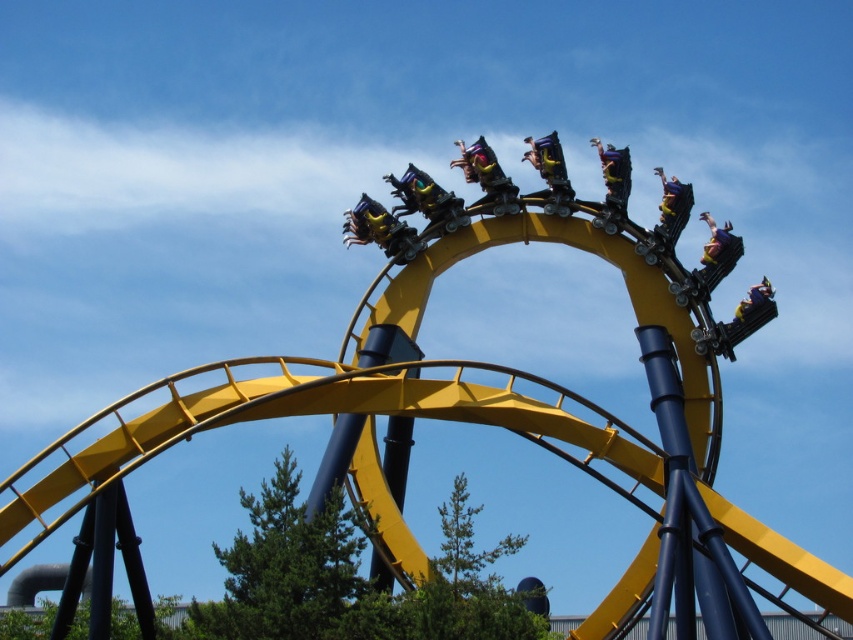
Question: Does matte yellow helmet at upper center appear under metallic yellow roller coaster car at upper right?

Choices:
 (A) yes
 (B) no

Answer: (B)

Question: Observing the image, what is the correct spatial positioning of matte yellow helmet at upper center in reference to yellow matte roller coaster car at upper right?

Choices:
 (A) left
 (B) right

Answer: (A)

Question: Based on their relative distances, which object is farther from the yellow matte roller coaster car at upper right?

Choices:
 (A) matte yellow helmet at upper center
 (B) matte yellow roller coaster car at upper right
 (C) metallic yellow roller coaster car at upper right

Answer: (A)

Question: Is matte yellow helmet at upper center in front of yellow matte roller coaster car at upper right?

Choices:
 (A) yes
 (B) no

Answer: (A)

Question: Based on their relative distances, which object is nearer to the yellow matte roller coaster car at upper right?

Choices:
 (A) matte yellow helmet at upper center
 (B) metallic yellow roller coaster car at upper right

Answer: (B)

Question: Which of the following is the closest to the observer?

Choices:
 (A) metallic yellow roller coaster car at upper right
 (B) yellow matte roller coaster car at upper right
 (C) matte yellow roller coaster car at upper right

Answer: (C)